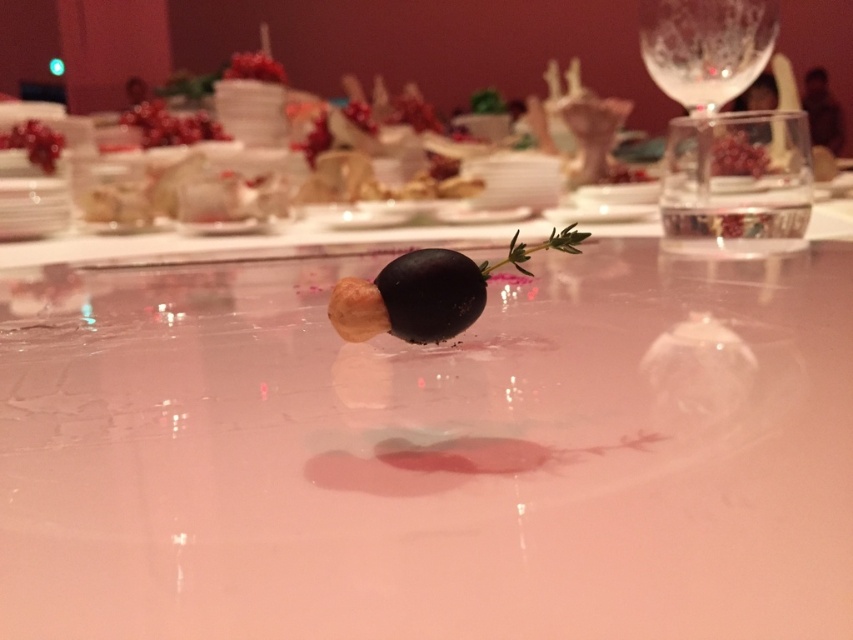
You are a guest at a formal dinner and notice the shiny black olive at center and the shiny red berries at upper center on the table. From your perspective, which object is positioned to the right side?

The shiny black olive at center is positioned to the right of the shiny red berries at upper center.

You are a guest at a formal dinner and want to place a napkin between the shiny black olive at center and the shiny red berries at upper center. Based on their sizes, which object will require more space to accommodate the napkin?

The shiny red berries at upper center will require more space to accommodate the napkin because they occupy more space than the shiny black olive at center.

You are a server at a formal event. You need to place a dessert plate on the table. The dessert plate is 12 inches in diameter. Can the shiny white table at center accommodate the dessert plate without overlapping the pomegranate seeds at upper left?

The shiny white table at center might be wider than pomegranate seeds at upper left, so there is a possibility that the dessert plate can be placed without overlapping. However, the exact dimensions are uncertain based on the provided information.